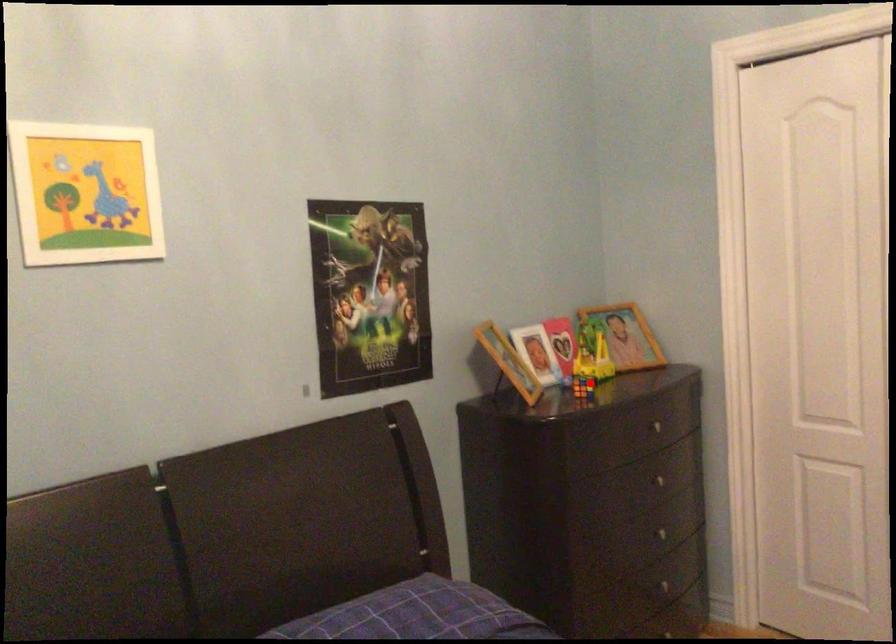
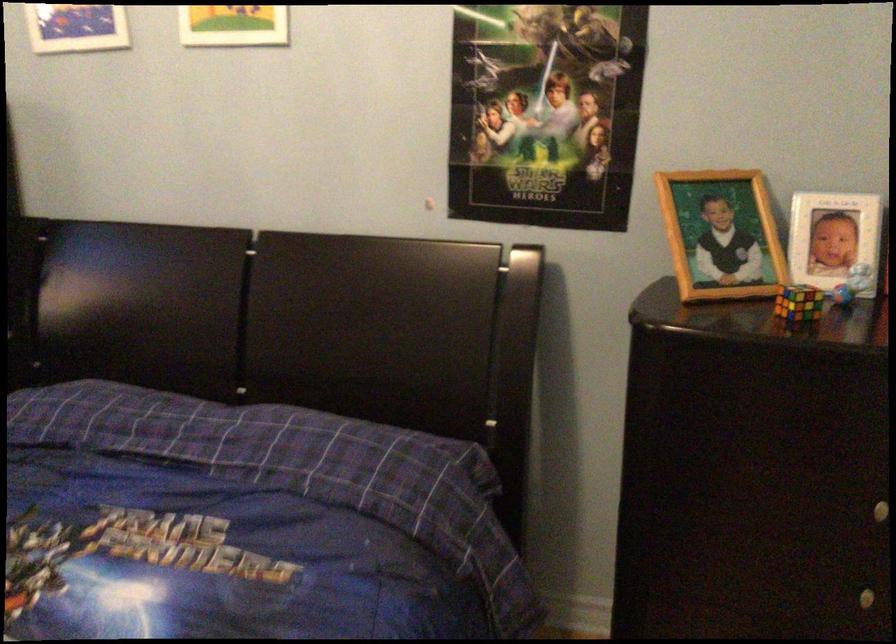
Question: I am providing you with two images of the same scene from different viewpoints. Image1 has a red point marked. In image2, the corresponding 3D location appears at what relative position? Reply with the corresponding letter.

Choices:
 (A) Closer
 (B) Farther

Answer: (A)